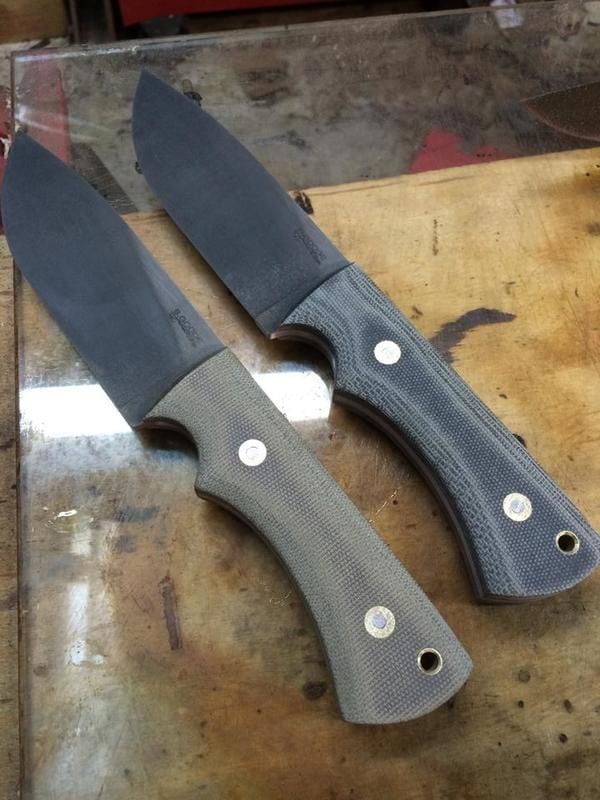
This screenshot has width=600, height=800. I want to click on handle, so click(340, 552), click(498, 482).